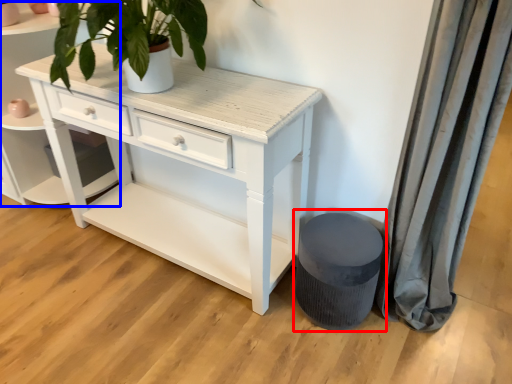
Question: Which object is closer to the camera taking this photo, music stool (highlighted by a red box) or shelf (highlighted by a blue box)?

Choices:
 (A) music stool
 (B) shelf

Answer: (A)